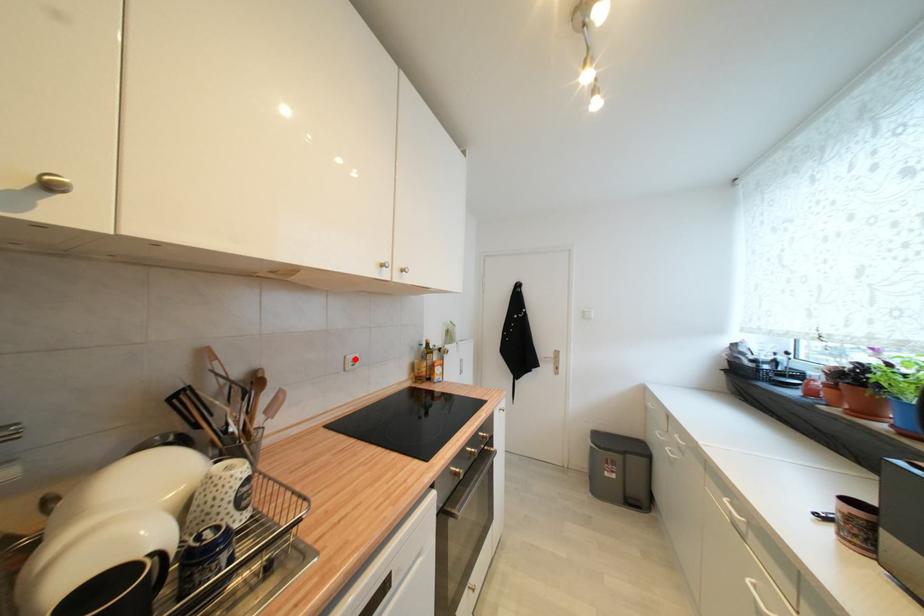
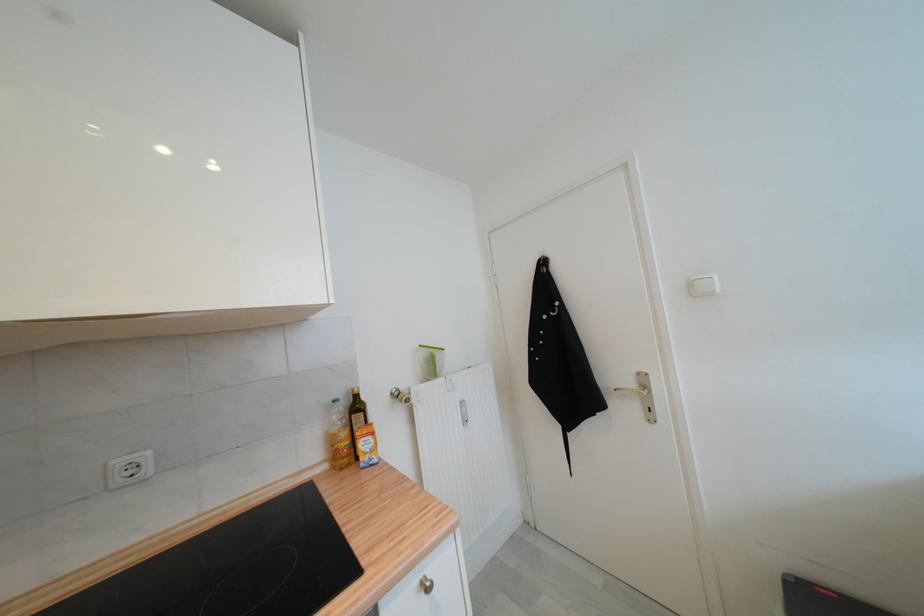
In the second image, find the point that corresponds to the highlighted location in the first image.

(126, 464)